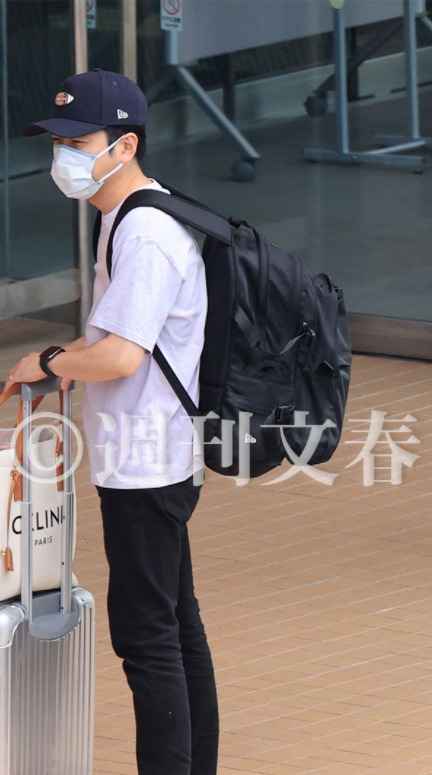
Image resolution: width=432 pixels, height=775 pixels. In order to click on handle in this screenshot , I will do `click(27, 460)`.